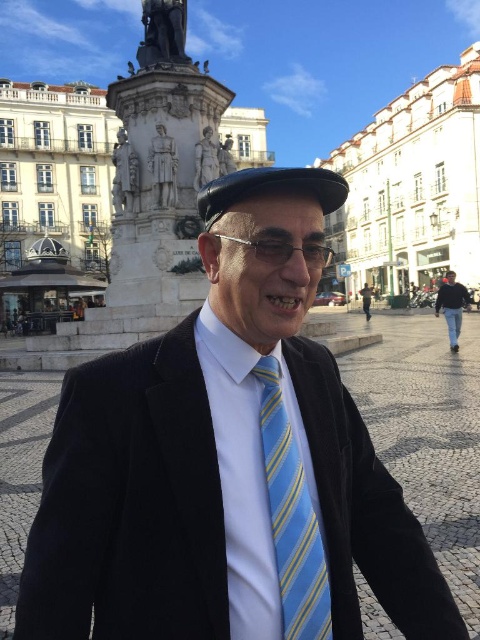
You are a photographer trying to capture the man in the black velvet suit at center and the blue striped tie at center. Which object is positioned closer to the camera?

The black velvet suit at center is closer to the viewer than the blue striped tie at center, so the black velvet suit at center will appear closer in the photograph.

You are a fashion designer observing a man in a public square. You notice the black velvet suit at center and the blue striped tie at center. Which item is covering the other?

The black velvet suit at center is positioned over the blue striped tie at center, so the suit is covering the tie.